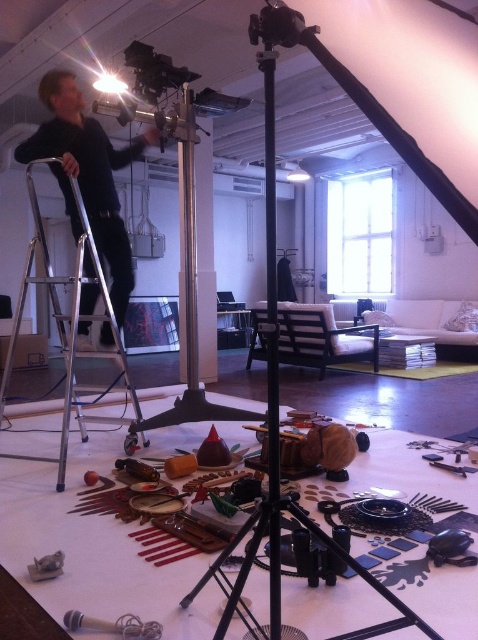
Question: In this image, where is black fabric man at left located relative to silver metallic ladder at left?

Choices:
 (A) right
 (B) left

Answer: (A)

Question: Which point appears farthest from the camera in this image?

Choices:
 (A) (122, 353)
 (B) (75, 138)

Answer: (B)

Question: Is black fabric man at left smaller than silver metallic ladder at left?

Choices:
 (A) no
 (B) yes

Answer: (B)

Question: Is the position of black fabric man at left less distant than that of silver metallic ladder at left?

Choices:
 (A) no
 (B) yes

Answer: (A)